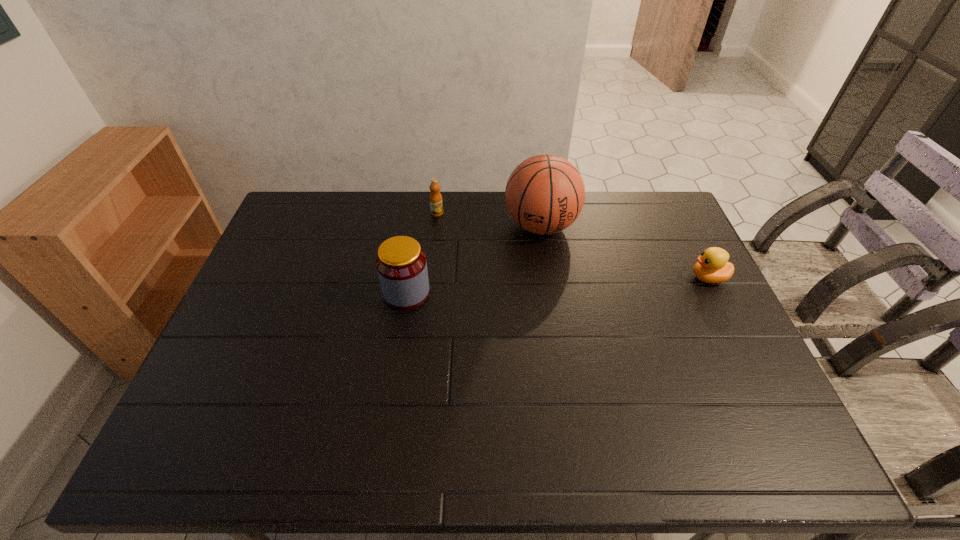
Find the location of a particular element. This screenshot has height=540, width=960. empty location between the second tallest object and the tallest object is located at coordinates (473, 259).

You are a GUI agent. You are given a task and a screenshot of the screen. Output one action in this format:
    pyautogui.click(x=<x>, y=<y>)
    Task: Click on the free space that is in between the jar and the second object from right to left
    The width and height of the screenshot is (960, 540).
    Given the screenshot: What is the action you would take?
    pyautogui.click(x=473, y=259)

Find the location of a particular element. The width and height of the screenshot is (960, 540). free space between the duckling and the second object from right to left is located at coordinates [x=625, y=252].

Point out which object is positioned as the second nearest to the rightmost object. Please provide its 2D coordinates. Your answer should be formatted as a tuple, i.e. [(x, y)], where the tuple contains the x and y coordinates of a point satisfying the conditions above.

[(401, 264)]

The width and height of the screenshot is (960, 540). I want to click on object identified as the closest to the jar, so click(545, 194).

At what (x,y) coordinates should I click in order to perform the action: click on free space that satisfies the following two spatial constraints: 1. on the back side of the second shortest object; 2. on the right side of the second tallest object. Please return your answer as a coordinate pair (x, y). Looking at the image, I should click on (419, 213).

This screenshot has height=540, width=960. I want to click on vacant space that satisfies the following two spatial constraints: 1. on the back side of the jar; 2. on the face of the duckling, so click(x=409, y=278).

You are a GUI agent. You are given a task and a screenshot of the screen. Output one action in this format:
    pyautogui.click(x=<x>, y=<y>)
    Task: Click on the vacant space that satisfies the following two spatial constraints: 1. on the front side of the orange juice; 2. on the face of the rightmost object
    Image resolution: width=960 pixels, height=540 pixels.
    Given the screenshot: What is the action you would take?
    pyautogui.click(x=430, y=278)

At what (x,y) coordinates should I click in order to perform the action: click on free space that satisfies the following two spatial constraints: 1. on the front side of the tallest object; 2. on the face of the rightmost object. Please return your answer as a coordinate pair (x, y). The width and height of the screenshot is (960, 540). Looking at the image, I should click on (548, 278).

The height and width of the screenshot is (540, 960). I want to click on vacant point that satisfies the following two spatial constraints: 1. on the back side of the orange juice; 2. on the right side of the jar, so click(419, 213).